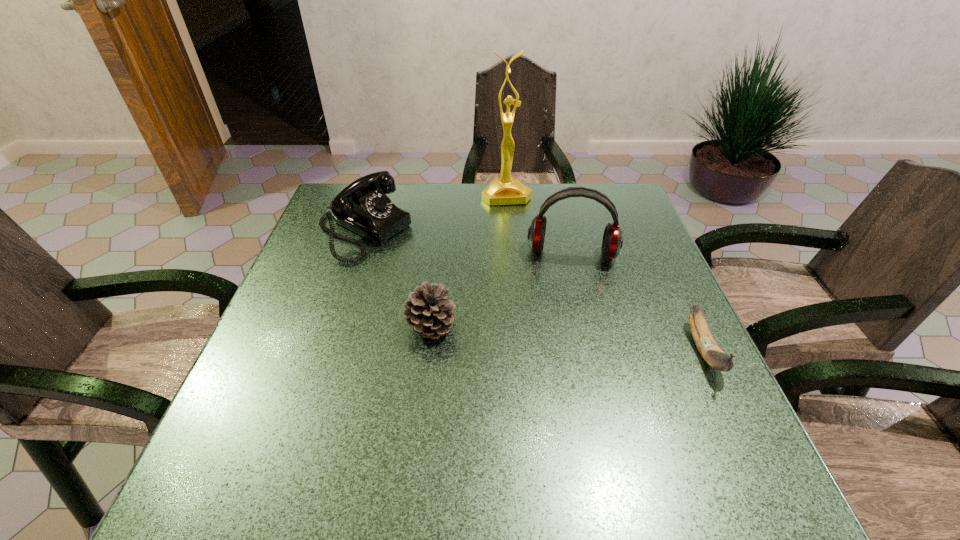
You are a GUI agent. You are given a task and a screenshot of the screen. Output one action in this format:
    pyautogui.click(x=<x>, y=<y>)
    Task: Click on the telephone present at the far edge
    Image resolution: width=960 pixels, height=540 pixels.
    Given the screenshot: What is the action you would take?
    pyautogui.click(x=363, y=206)

Where is `object present at the left edge`? The height and width of the screenshot is (540, 960). object present at the left edge is located at coordinates (363, 206).

I want to click on banana at the right edge, so click(x=711, y=352).

This screenshot has width=960, height=540. I want to click on earphone at the right edge, so click(612, 242).

What are the coordinates of `object that is at the far left corner` in the screenshot? It's located at (363, 206).

At what (x,y) coordinates should I click in order to perform the action: click on vacant space at the far edge of the desktop. Please return your answer as a coordinate pair (x, y). The image size is (960, 540). Looking at the image, I should click on pyautogui.click(x=462, y=226).

Where is `free space at the near edge of the desktop`? free space at the near edge of the desktop is located at coordinates (531, 429).

Locate an element on the screen. free location at the left edge is located at coordinates (306, 375).

The height and width of the screenshot is (540, 960). I want to click on free space at the right edge, so click(684, 310).

Image resolution: width=960 pixels, height=540 pixels. In order to click on vacant area at the far left corner in this screenshot , I will do `click(334, 188)`.